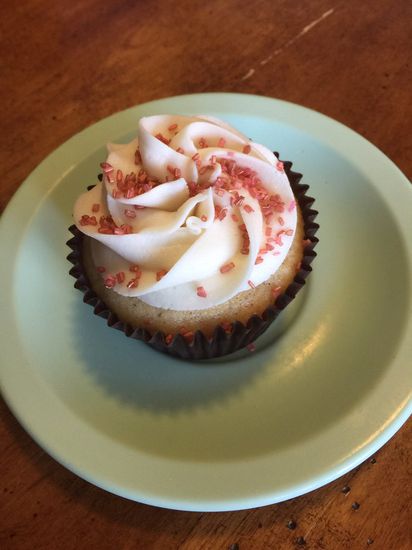
Where is `round white shallow bowl`? round white shallow bowl is located at coordinates coord(196,471).